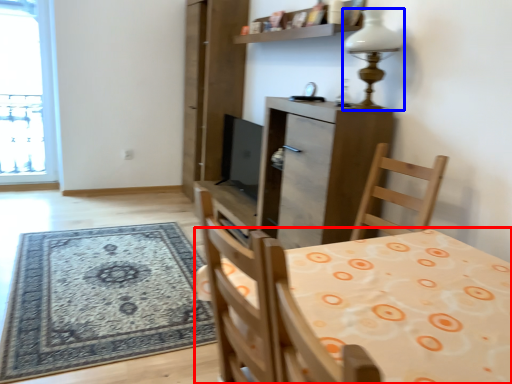
Question: Which object is further to the camera taking this photo, table (highlighted by a red box) or lamp (highlighted by a blue box)?

Choices:
 (A) table
 (B) lamp

Answer: (B)